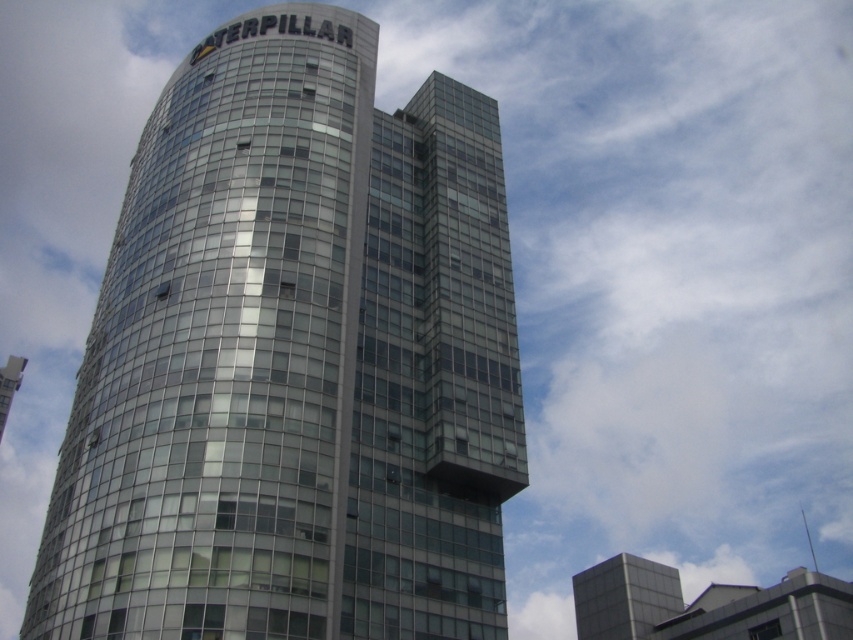
Question: Among these objects, which one is nearest to the camera?

Choices:
 (A) metallic glass building at upper right
 (B) transparent glass building at center

Answer: (B)

Question: Observing the image, what is the correct spatial positioning of transparent glass building at center in reference to metallic glass building at upper right?

Choices:
 (A) left
 (B) right

Answer: (A)

Question: Which point appears closest to the camera in this image?

Choices:
 (A) (639, 566)
 (B) (260, 445)

Answer: (B)

Question: Considering the relative positions of transparent glass building at center and metallic glass building at upper right in the image provided, where is transparent glass building at center located with respect to metallic glass building at upper right?

Choices:
 (A) left
 (B) right

Answer: (A)

Question: Does transparent glass building at center have a larger size compared to metallic glass building at upper right?

Choices:
 (A) no
 (B) yes

Answer: (A)